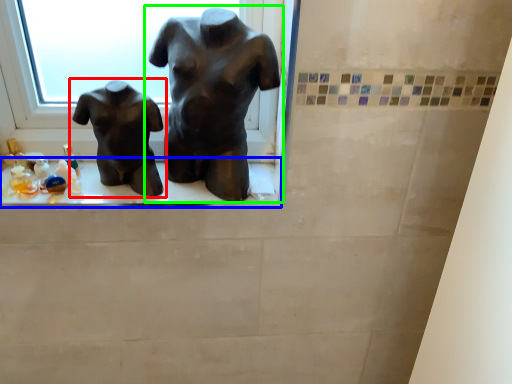
Question: Which object is the farthest from statue (sculpture) (highlighted by a red box)? Choose among these: window sill (highlighted by a blue box) or statue (sculpture) (highlighted by a green box).

Choices:
 (A) window sill
 (B) statue (sculpture)

Answer: (B)